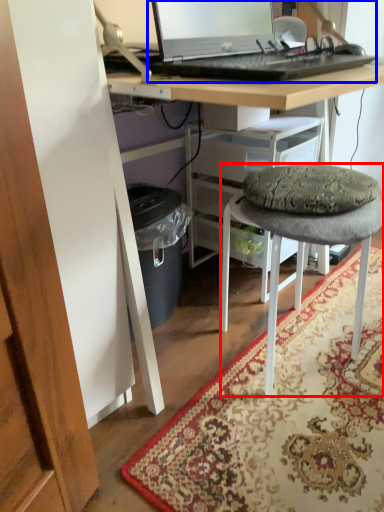
Question: Among these objects, which one is nearest to the camera, stool (highlighted by a red box) or computer (highlighted by a blue box)?

Choices:
 (A) stool
 (B) computer

Answer: (B)